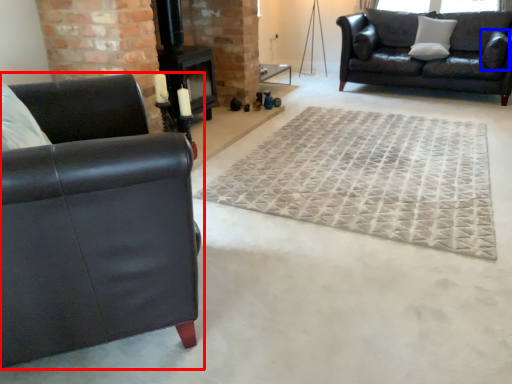
Question: Which object appears closest to the camera in this image, studio couch (highlighted by a red box) or pillow (highlighted by a blue box)?

Choices:
 (A) studio couch
 (B) pillow

Answer: (A)